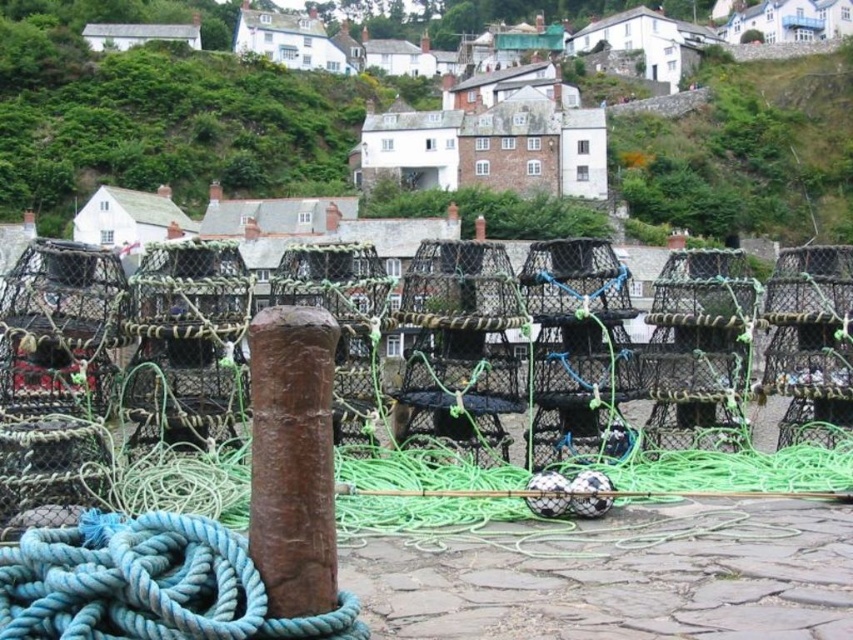
Question: Can you confirm if blue rope at lower left is thinner than rusty wood post at center?

Choices:
 (A) no
 (B) yes

Answer: (A)

Question: Does blue rope at lower left appear over rusty wood post at center?

Choices:
 (A) no
 (B) yes

Answer: (A)

Question: Does blue rope at lower left lie behind rusty wood post at center?

Choices:
 (A) no
 (B) yes

Answer: (A)

Question: Which of the following is the closest to the observer?

Choices:
 (A) rusty wood post at center
 (B) blue rope at lower left

Answer: (B)